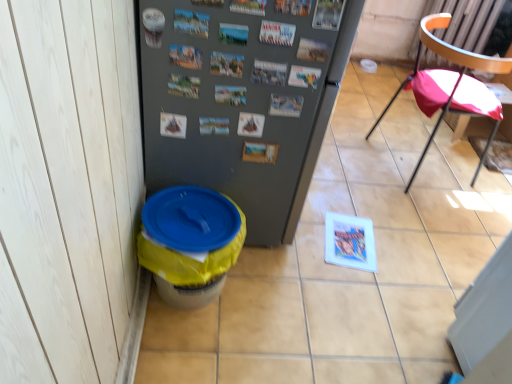
Where is `free space between pink fabric chair at right and yellow plastic potty at lower left`? free space between pink fabric chair at right and yellow plastic potty at lower left is located at coordinates (349, 220).